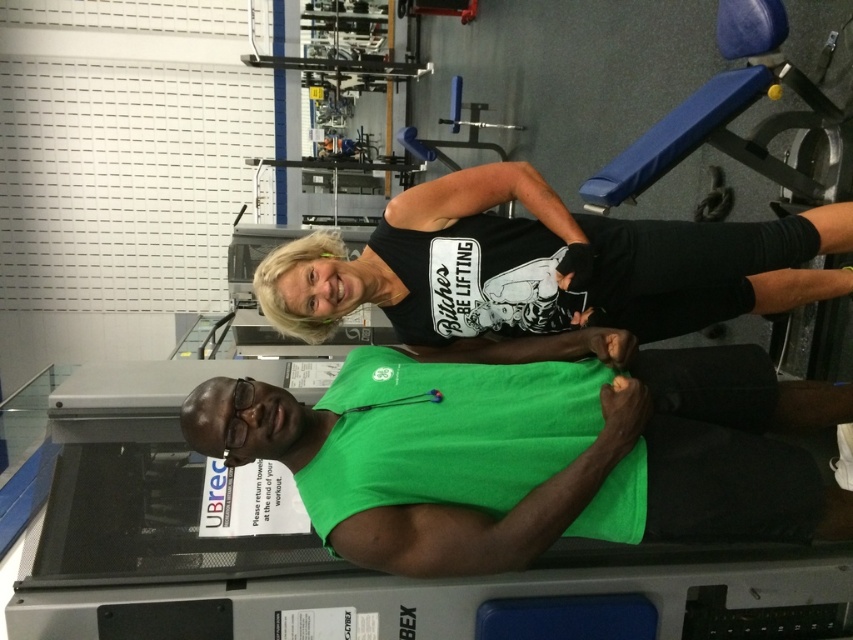
Question: Is green fabric squat at center thinner than black matte tank top at upper center?

Choices:
 (A) yes
 (B) no

Answer: (A)

Question: Does green fabric squat at center come behind black matte tank top at upper center?

Choices:
 (A) no
 (B) yes

Answer: (A)

Question: Which point is farther to the camera?

Choices:
 (A) black matte tank top at upper center
 (B) green fabric squat at center

Answer: (A)

Question: Which of the following is the closest to the observer?

Choices:
 (A) (444, 248)
 (B) (436, 476)

Answer: (B)

Question: Can you confirm if green fabric squat at center is positioned above black matte tank top at upper center?

Choices:
 (A) no
 (B) yes

Answer: (A)